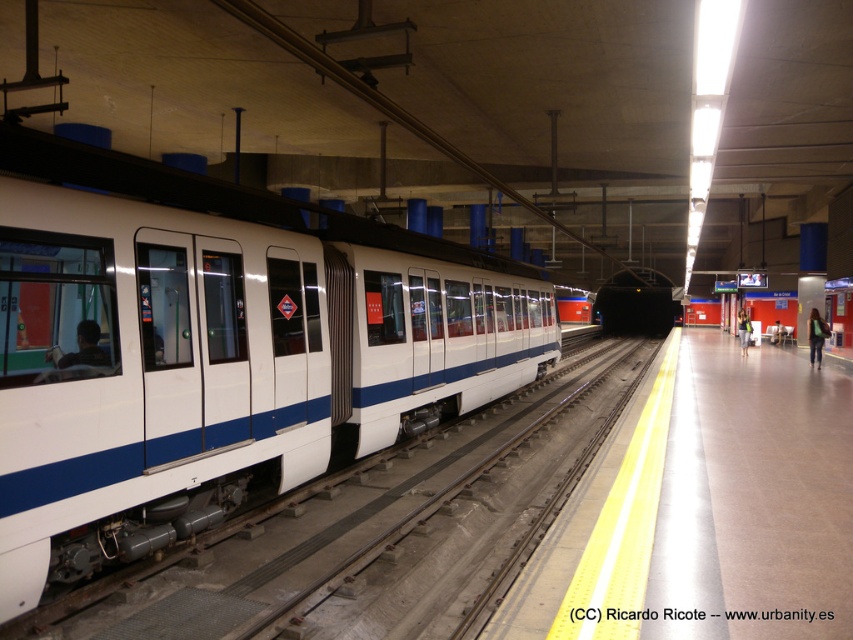
The image size is (853, 640). What do you see at coordinates (215, 349) in the screenshot?
I see `white glossy train at left` at bounding box center [215, 349].

Consider the image. Does white glossy train at left lie behind green fabric bag at right?

No.

This screenshot has height=640, width=853. What do you see at coordinates (215, 349) in the screenshot? I see `white glossy train at left` at bounding box center [215, 349].

Identify the location of white glossy train at left. Image resolution: width=853 pixels, height=640 pixels. (215, 349).

Is point (817, 340) closer to viewer compared to point (746, 349)?

Yes.

Does green fabric bag at right appear on the left side of denim jacket at right?

Yes, green fabric bag at right is to the left of denim jacket at right.

Image resolution: width=853 pixels, height=640 pixels. What do you see at coordinates (816, 337) in the screenshot?
I see `green fabric bag at right` at bounding box center [816, 337].

Image resolution: width=853 pixels, height=640 pixels. In order to click on green fabric bag at right in this screenshot , I will do `click(816, 337)`.

Is white glossy train at left wider than denim jacket at right?

Yes, white glossy train at left is wider than denim jacket at right.

Is white glossy train at left smaller than denim jacket at right?

No.

Between point (297, 230) and point (744, 324), which one is positioned in front?

Point (297, 230) is more forward.

This screenshot has height=640, width=853. Identify the location of white glossy train at left. (215, 349).